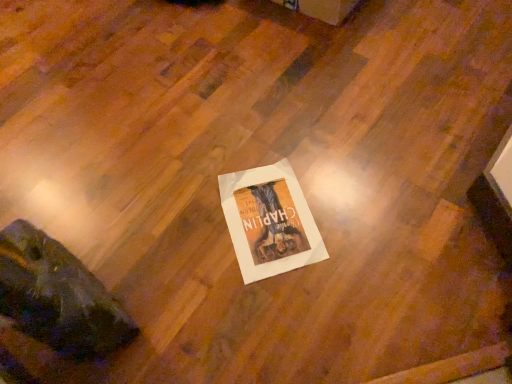
Find the location of a particular element. This screenshot has height=384, width=512. free space to the left of white paper book at center is located at coordinates (186, 242).